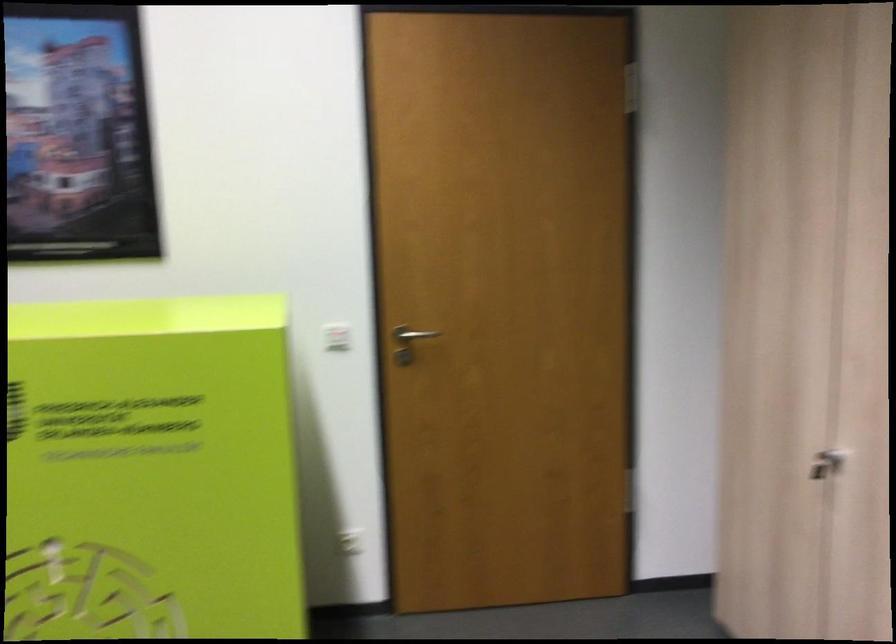
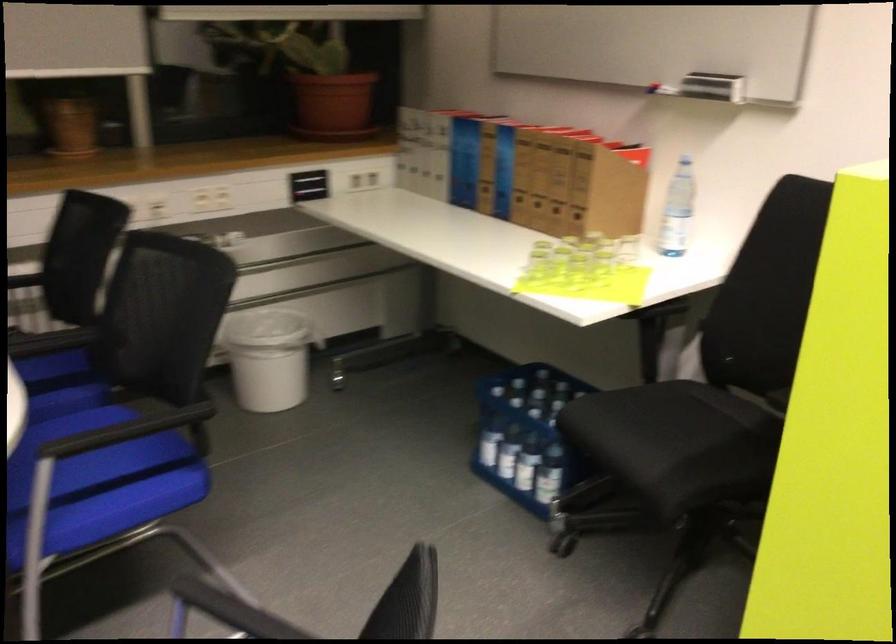
The first image is from the beginning of the video and the second image is from the end. How did the camera likely rotate when shooting the video?

The rotation direction of the camera is left-down.